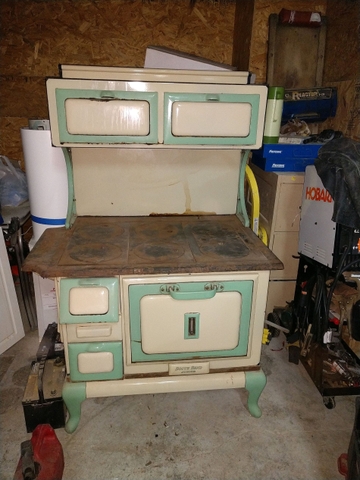
Identify the location of oven. (172, 313).